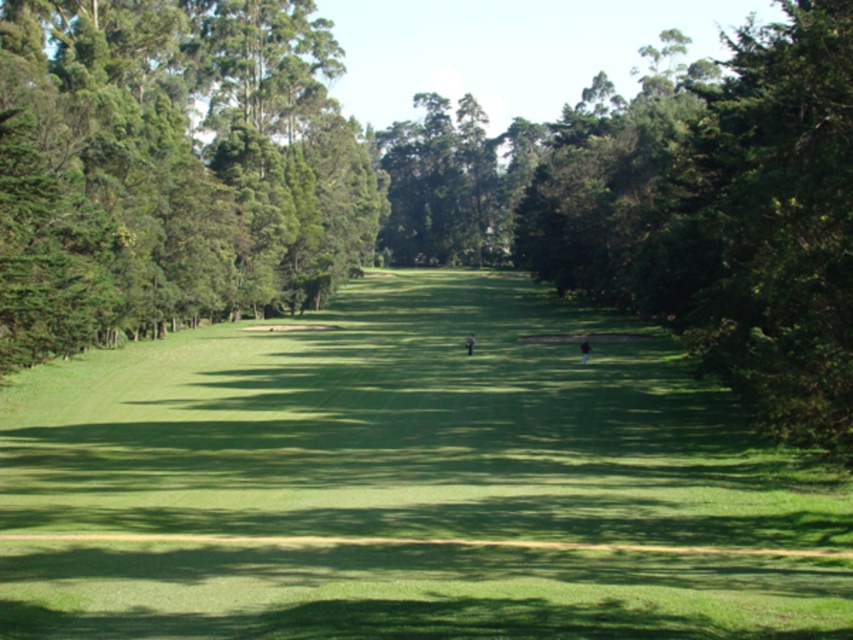
You are a golfer standing on the fairway and see the green leafy trees at left and the dark brown leather golfer at center. Which object is closer to you?

The green leafy trees at left are closer to you since they are positioned in front of the dark brown leather golfer at center.

You are a golfer standing on the fairway of the golf course. You see two points marked on the fairway. Which point is closer to you, point (x=245, y=307) or point (x=589, y=349)?

Point (x=245, y=307) is closer to you because it is further to the viewer than point (x=589, y=349).

You are a golfer standing on the green grassy field at center. You want to hit the ball to the dark brown leather golfer at center. Since both are at center, which direction should you aim to reach the golfer?

The green grassy field at center is bigger than the dark brown leather golfer at center, so you should aim directly at the center where the dark brown leather golfer at center is positioned since the golfer is smaller and located within the larger field area.